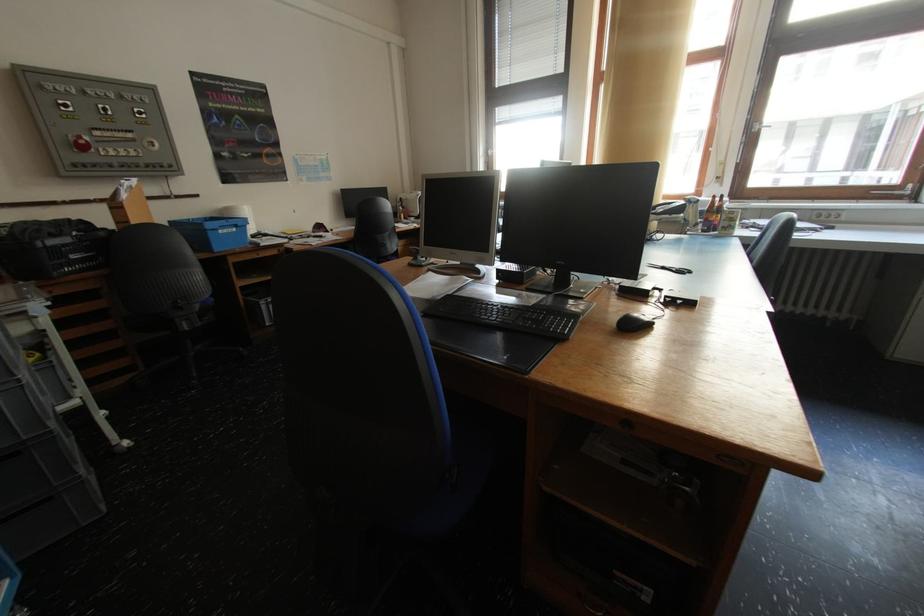
Locate an element on the screen. The width and height of the screenshot is (924, 616). brown window handle is located at coordinates (896, 192).